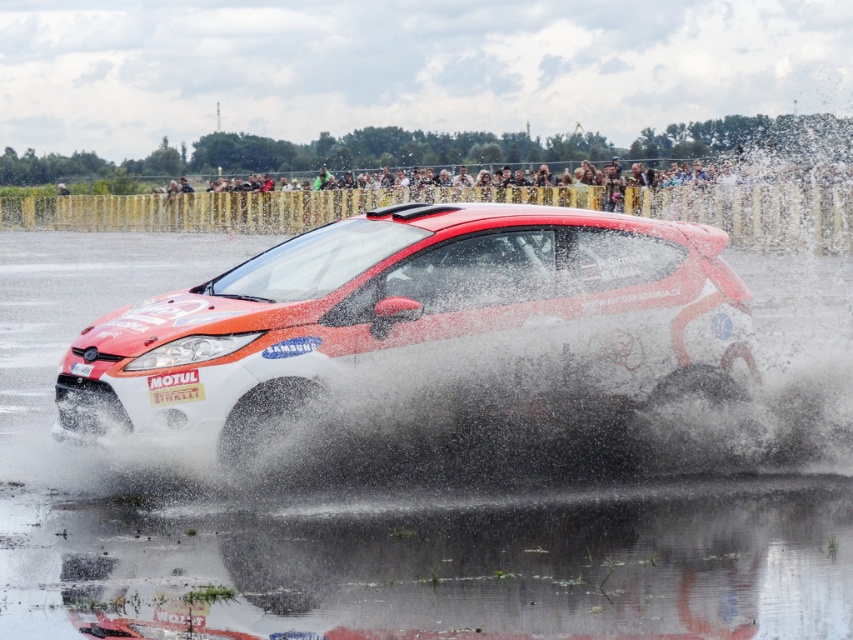
Question: Among these points, which one is nearest to the camera?

Choices:
 (A) (277, 440)
 (B) (320, 314)

Answer: (A)

Question: Is shiny white car at center smaller than black rubber tire at center?

Choices:
 (A) yes
 (B) no

Answer: (B)

Question: Can you confirm if shiny white car at center is wider than black rubber tire at center?

Choices:
 (A) yes
 (B) no

Answer: (A)

Question: Which of the following is the closest to the observer?

Choices:
 (A) (262, 426)
 (B) (256, 410)

Answer: (A)

Question: Observing the image, what is the correct spatial positioning of shiny white car at center in reference to black rubber tire at center?

Choices:
 (A) above
 (B) below

Answer: (A)